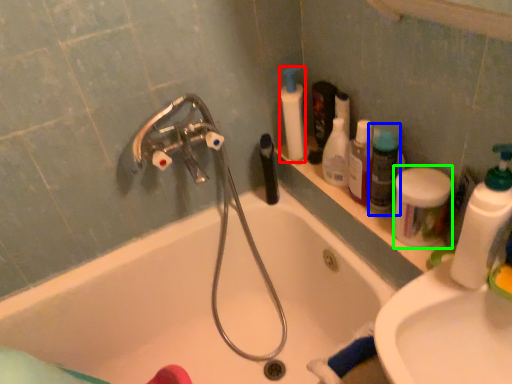
Question: Considering the real-world distances, which object is farthest from cleaning product (highlighted by a red box)? cleaning product (highlighted by a blue box) or cleaning product (highlighted by a green box)?

Choices:
 (A) cleaning product
 (B) cleaning product

Answer: (B)